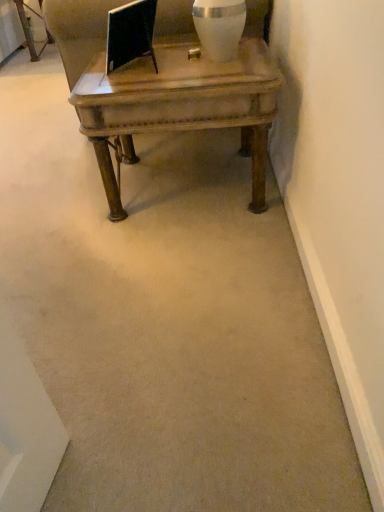
This screenshot has width=384, height=512. Find the location of `vacant point to the right of white glossy vase at upper center`. vacant point to the right of white glossy vase at upper center is located at coordinates (252, 54).